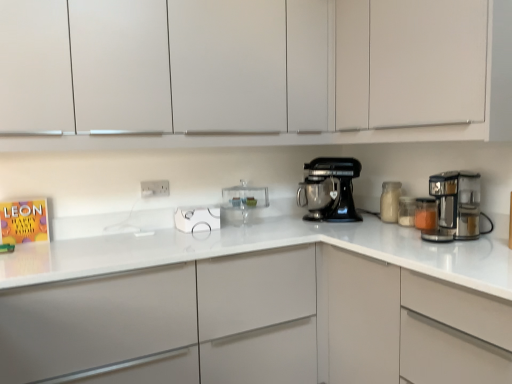
Question: Considering the relative sizes of white glass jar at right, marked as the 2th kitchen appliance in a left-to-right arrangement, and white matte cabinet at upper center, the third cabinetry when ordered from bottom to top, in the image provided, is white glass jar at right, marked as the 2th kitchen appliance in a left-to-right arrangement, taller than white matte cabinet at upper center, the third cabinetry when ordered from bottom to top,?

Choices:
 (A) yes
 (B) no

Answer: (B)

Question: From a real-world perspective, does white glass jar at right, marked as the 2th kitchen appliance in a left-to-right arrangement, stand above white matte cabinet at upper center, acting as the first cabinetry starting from the top?

Choices:
 (A) no
 (B) yes

Answer: (A)

Question: Could white matte cabinet at upper center, the third cabinetry when ordered from bottom to top, be considered to be inside white glass jar at right, marked as the 2th kitchen appliance in a left-to-right arrangement?

Choices:
 (A) yes
 (B) no

Answer: (B)

Question: Is white glass jar at right, which ranks as the third kitchen appliance in right-to-left order, thinner than white matte cabinet at upper center, the third cabinetry when ordered from bottom to top?

Choices:
 (A) no
 (B) yes

Answer: (B)

Question: Is there a large distance between white glass jar at right, marked as the 2th kitchen appliance in a left-to-right arrangement, and white matte cabinet at upper center, the third cabinetry when ordered from bottom to top?

Choices:
 (A) no
 (B) yes

Answer: (A)

Question: Is white glass jar at right, which ranks as the third kitchen appliance in right-to-left order, touching white matte cabinet at upper center, acting as the first cabinetry starting from the top?

Choices:
 (A) no
 (B) yes

Answer: (A)

Question: From a real-world perspective, is white matte cabinet at upper center, acting as the first cabinetry starting from the top, on top of white matte cabinet at upper center, marked as the 2th cabinetry in a bottom-to-top arrangement?

Choices:
 (A) no
 (B) yes

Answer: (A)

Question: Can you confirm if white matte cabinet at upper center, acting as the first cabinetry starting from the top, is taller than white matte cabinet at upper center, marked as the 2th cabinetry in a bottom-to-top arrangement?

Choices:
 (A) yes
 (B) no

Answer: (B)

Question: Considering the relative sizes of white matte cabinet at upper center, acting as the first cabinetry starting from the top, and white matte cabinet at upper center, marked as the 2th cabinetry in a bottom-to-top arrangement, in the image provided, is white matte cabinet at upper center, acting as the first cabinetry starting from the top, smaller than white matte cabinet at upper center, marked as the 2th cabinetry in a bottom-to-top arrangement,?

Choices:
 (A) no
 (B) yes

Answer: (B)

Question: Considering the relative sizes of white matte cabinet at upper center, acting as the first cabinetry starting from the top, and white matte cabinet at upper center, marked as the 2th cabinetry in a bottom-to-top arrangement, in the image provided, is white matte cabinet at upper center, acting as the first cabinetry starting from the top, wider than white matte cabinet at upper center, marked as the 2th cabinetry in a bottom-to-top arrangement,?

Choices:
 (A) yes
 (B) no

Answer: (B)

Question: Does white matte cabinet at upper center, acting as the first cabinetry starting from the top, appear on the left side of white matte cabinet at upper center, marked as the 2th cabinetry in a bottom-to-top arrangement?

Choices:
 (A) no
 (B) yes

Answer: (A)

Question: Would you say white matte cabinet at upper center, acting as the first cabinetry starting from the top, is outside white matte cabinet at upper center, positioned as the second cabinetry in top-to-bottom order?

Choices:
 (A) no
 (B) yes

Answer: (A)

Question: Does translucent glass jar at right, which ranks as the second kitchen appliance in right-to-left order, contain white glass jar at right, marked as the 2th kitchen appliance in a left-to-right arrangement?

Choices:
 (A) no
 (B) yes

Answer: (A)